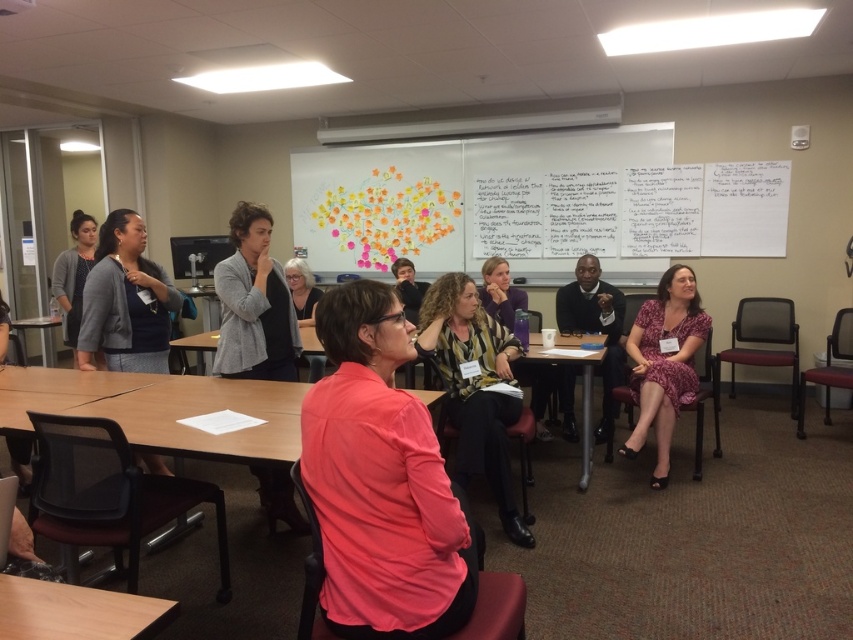
You are standing at the entrance of the conference room. You need to locate the matte gray cardigan at left. Where should you look relative to the entrance?

The matte gray cardigan at left is located at point (x=74, y=273), which corresponds to the upper left corner of the room from the entrance.

Looking at this image, you are standing in the conference room and want to determine which of the two points, point (68,321) or point (306,269), is nearer to you. Based on the scene description, which point is closer?

Point (68,321) is closer to the camera than point (306,269), so it is the nearer point.

You are standing in the conference room and want to walk towards the point that is closer to the camera between the two points labeled as point (294, 216) and point (241, 308). Which point should you walk towards?

You should walk towards point (241, 308) because it is closer to the camera compared to point (294, 216).